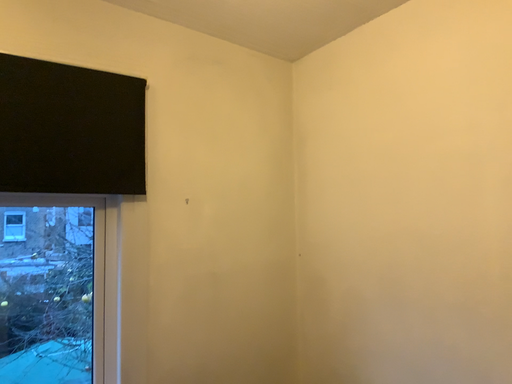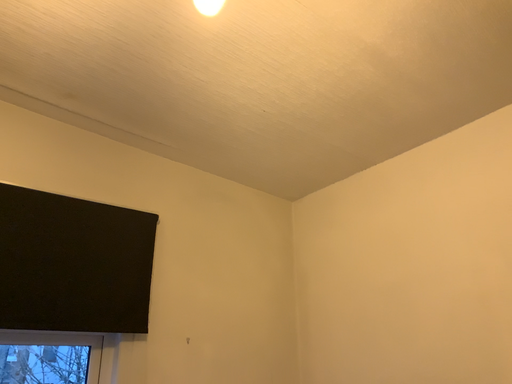
Question: Which way did the camera rotate in the video?

Choices:
 (A) rotated upward
 (B) rotated downward

Answer: (A)